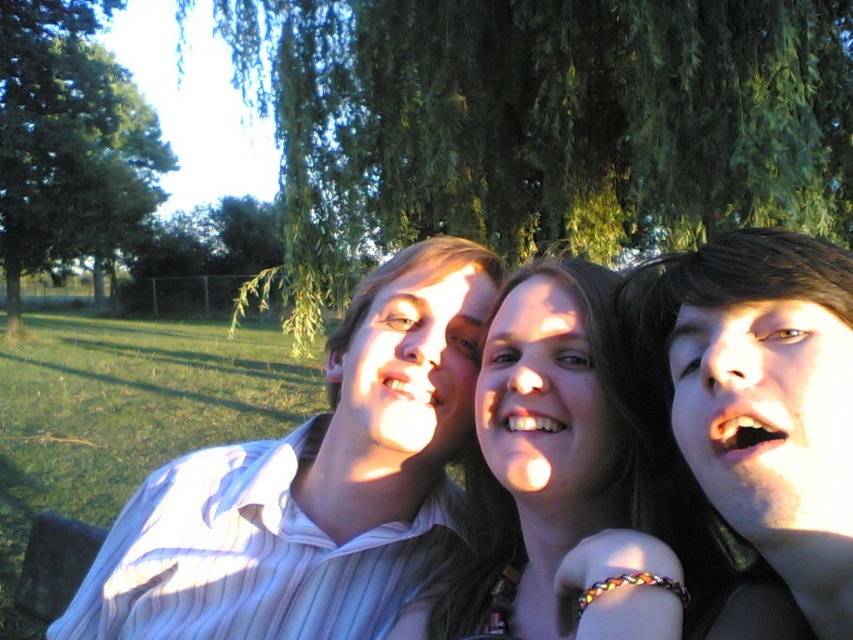
Question: Which object appears farthest from the camera in this image?

Choices:
 (A) green leafy willow at upper center
 (B) green leafy tree at upper left
 (C) matte skin at center
 (D) white striped shirt at center

Answer: (B)

Question: Is green leafy willow at upper center to the right of white striped shirt at center from the viewer's perspective?

Choices:
 (A) yes
 (B) no

Answer: (A)

Question: Which object appears farthest from the camera in this image?

Choices:
 (A) green leafy tree at upper left
 (B) smooth skin face at center
 (C) matte skin at center

Answer: (A)

Question: Does smooth skin face at center appear on the right side of green leafy tree at upper left?

Choices:
 (A) no
 (B) yes

Answer: (B)

Question: Which object appears farthest from the camera in this image?

Choices:
 (A) green leafy willow at upper center
 (B) matte skin at center
 (C) white striped shirt at center
 (D) green leafy tree at upper left

Answer: (D)

Question: Does white striped shirt at center have a lesser width compared to green leafy tree at upper left?

Choices:
 (A) no
 (B) yes

Answer: (B)